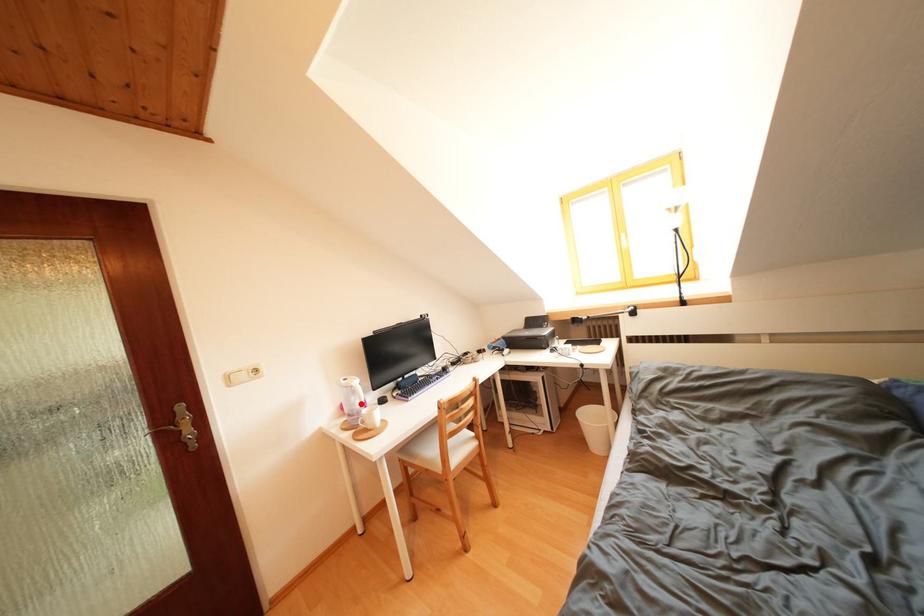
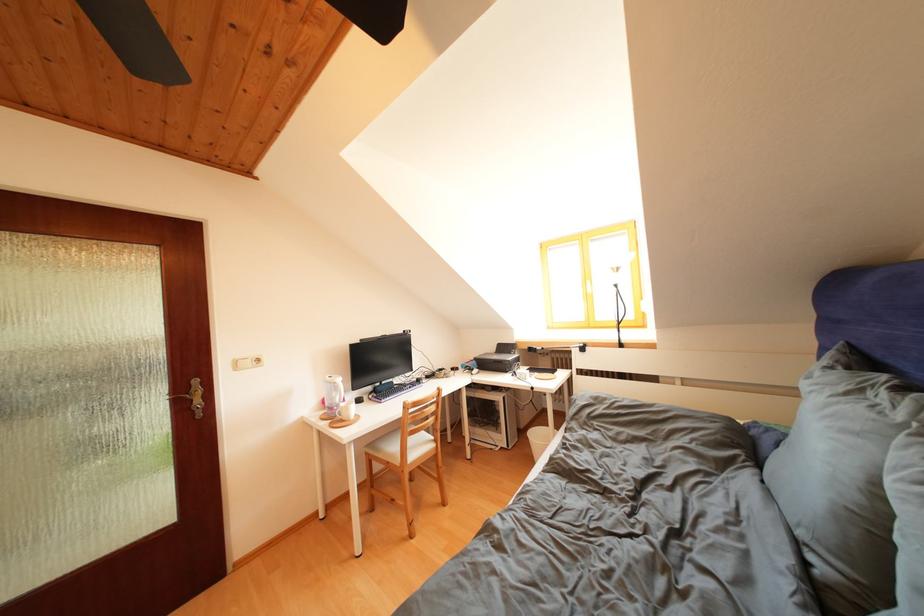
Question: I am providing you with two images of the same scene from different viewpoints. A red point is marked on the first image. At the location where the point appears in image 1, is it still visible in image 2?

Choices:
 (A) Yes
 (B) No

Answer: (A)